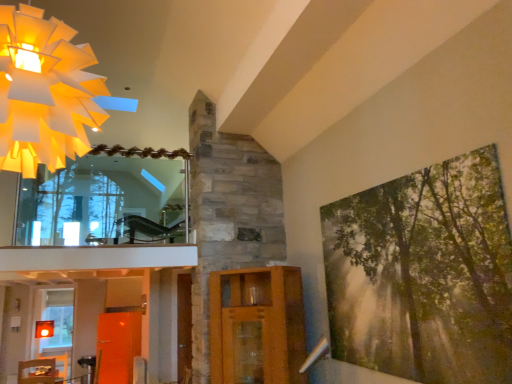
What do you see at coordinates (257, 326) in the screenshot? I see `wooden cabinet at center` at bounding box center [257, 326].

This screenshot has width=512, height=384. What are the coordinates of `wooden table at lower left` in the screenshot? It's located at (45, 375).

Locate an element on the screen. This screenshot has width=512, height=384. green textured canvas at right is located at coordinates (424, 274).

The height and width of the screenshot is (384, 512). Describe the element at coordinates (424, 274) in the screenshot. I see `green textured canvas at right` at that location.

Identify the location of wooden cabinet at center. This screenshot has width=512, height=384. (257, 326).

Is matte paper chandelier at upper left oriented towards green textured canvas at right?

No, matte paper chandelier at upper left is not aimed at green textured canvas at right.

Which is behind, matte paper chandelier at upper left or green textured canvas at right?

Positioned behind is green textured canvas at right.

From the picture: Considering the sizes of objects matte paper chandelier at upper left and green textured canvas at right in the image provided, who is shorter, matte paper chandelier at upper left or green textured canvas at right?

With less height is matte paper chandelier at upper left.

Considering the points (34, 38) and (368, 301), which point is behind, point (34, 38) or point (368, 301)?

The point (368, 301) is more distant.

Considering the points (248, 365) and (53, 359), which point is behind, point (248, 365) or point (53, 359)?

The point (53, 359) is farther.

Image resolution: width=512 pixels, height=384 pixels. Identify the location of elevator in front of the wooden table at lower left. (257, 326).

Is wooden cabinet at center in front of or behind wooden table at lower left in the image?

Visually, wooden cabinet at center is located in front of wooden table at lower left.

From a real-world perspective, between wooden cabinet at center and wooden table at lower left, who is vertically higher?

wooden cabinet at center.

Does matte paper chandelier at upper left touch wooden cabinet at center?

No.

From the image's perspective, is matte paper chandelier at upper left below wooden cabinet at center?

No, from the image's perspective, matte paper chandelier at upper left is not beneath wooden cabinet at center.

Based on the photo, from a real-world perspective, which is physically above, matte paper chandelier at upper left or wooden cabinet at center?

matte paper chandelier at upper left is physically above.

From the image's perspective, does translucent glass window at lower left appear higher than clear glass mirror at upper left?

No, from the image's perspective, translucent glass window at lower left is not on top of clear glass mirror at upper left.

Locate an element on the screen. This screenshot has width=512, height=384. mirror lying on the right of translucent glass window at lower left is located at coordinates click(x=106, y=201).

From a real-world perspective, is translucent glass window at lower left located higher than clear glass mirror at upper left?

Incorrect, from a real-world perspective, translucent glass window at lower left is lower than clear glass mirror at upper left.

Is translucent glass window at lower left inside or outside of clear glass mirror at upper left?

translucent glass window at lower left exists outside the volume of clear glass mirror at upper left.

Is translucent glass window at lower left facing away from green textured canvas at right?

No, translucent glass window at lower left is not facing away from green textured canvas at right.

Can you confirm if translucent glass window at lower left is taller than green textured canvas at right?

Indeed, translucent glass window at lower left has a greater height compared to green textured canvas at right.

Does point (63, 308) come behind point (354, 281)?

Yes.

Based on the photo, from the image's perspective, is translucent glass window at lower left located beneath green textured canvas at right?

Yes.

Would you say wooden table at lower left is outside matte paper chandelier at upper left?

wooden table at lower left is positioned outside matte paper chandelier at upper left.

Can you confirm if wooden table at lower left is wider than matte paper chandelier at upper left?

Yes.

Which is in front, clear glass mirror at upper left or translucent glass window at lower left?

Positioned in front is clear glass mirror at upper left.

In the scene shown: Which of these two, clear glass mirror at upper left or translucent glass window at lower left, is bigger?

With larger size is translucent glass window at lower left.

Which is behind, point (53, 183) or point (42, 339)?

Positioned behind is point (42, 339).

At what (x,y) coordinates should I click in order to perform the action: click on chandelier on the left of the green textured canvas at right. Please return your answer as a coordinate pair (x, y). Looking at the image, I should click on (44, 92).

Image resolution: width=512 pixels, height=384 pixels. In order to click on elevator lying above the wooden table at lower left (from the image's perspective) in this screenshot , I will do `click(257, 326)`.

When comparing their distances from translucent glass window at lower left, does clear glass mirror at upper left or green textured canvas at right seem closer?

Based on the image, clear glass mirror at upper left appears to be nearer to translucent glass window at lower left.

Estimate the real-world distances between objects in this image. Which object is further from matte paper chandelier at upper left, wooden table at lower left or green textured canvas at right?

wooden table at lower left is positioned further to the anchor matte paper chandelier at upper left.

Considering their positions, is translucent glass window at lower left positioned closer to wooden table at lower left than clear glass mirror at upper left?

Based on the image, translucent glass window at lower left appears to be nearer to wooden table at lower left.

When comparing their distances from green textured canvas at right, does matte paper chandelier at upper left or translucent glass window at lower left seem closer?

matte paper chandelier at upper left is positioned closer to the anchor green textured canvas at right.

In the scene shown: Looking at the image, which one is located further to translucent glass window at lower left, green textured canvas at right or wooden cabinet at center?

green textured canvas at right is positioned further to the anchor translucent glass window at lower left.

Considering their positions, is wooden table at lower left positioned further to clear glass mirror at upper left than wooden cabinet at center?

wooden table at lower left is further to clear glass mirror at upper left.

Estimate the real-world distances between objects in this image. Which object is further from wooden cabinet at center, translucent glass window at lower left or clear glass mirror at upper left?

Among the two, translucent glass window at lower left is located further to wooden cabinet at center.

Considering their positions, is wooden table at lower left positioned further to wooden cabinet at center than translucent glass window at lower left?

The object further to wooden cabinet at center is wooden table at lower left.

The height and width of the screenshot is (384, 512). Identify the location of elevator located between matte paper chandelier at upper left and translucent glass window at lower left in the depth direction. (257, 326).

Identify the location of mirror between green textured canvas at right and translucent glass window at lower left from front to back. Image resolution: width=512 pixels, height=384 pixels. (106, 201).

Where is `mirror located between wooden table at lower left and green textured canvas at right in the left-right direction`? mirror located between wooden table at lower left and green textured canvas at right in the left-right direction is located at coordinates (106, 201).

You are a GUI agent. You are given a task and a screenshot of the screen. Output one action in this format:
    pyautogui.click(x=<x>, y=<y>)
    Task: Click on the mirror between wooden cabinet at center and translucent glass window at lower left from front to back
    Image resolution: width=512 pixels, height=384 pixels.
    Given the screenshot: What is the action you would take?
    pyautogui.click(x=106, y=201)